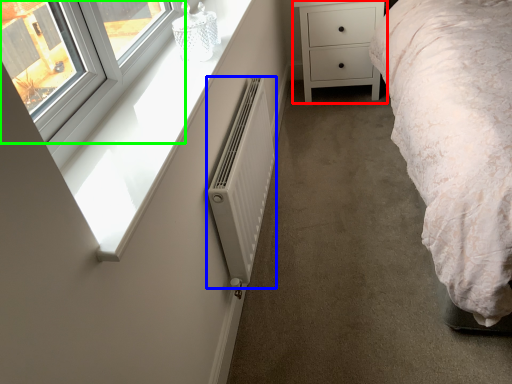
Question: Considering the real-world distances, which object is farthest from chest of drawers (highlighted by a red box)? radiator (highlighted by a blue box) or window (highlighted by a green box)?

Choices:
 (A) radiator
 (B) window

Answer: (B)